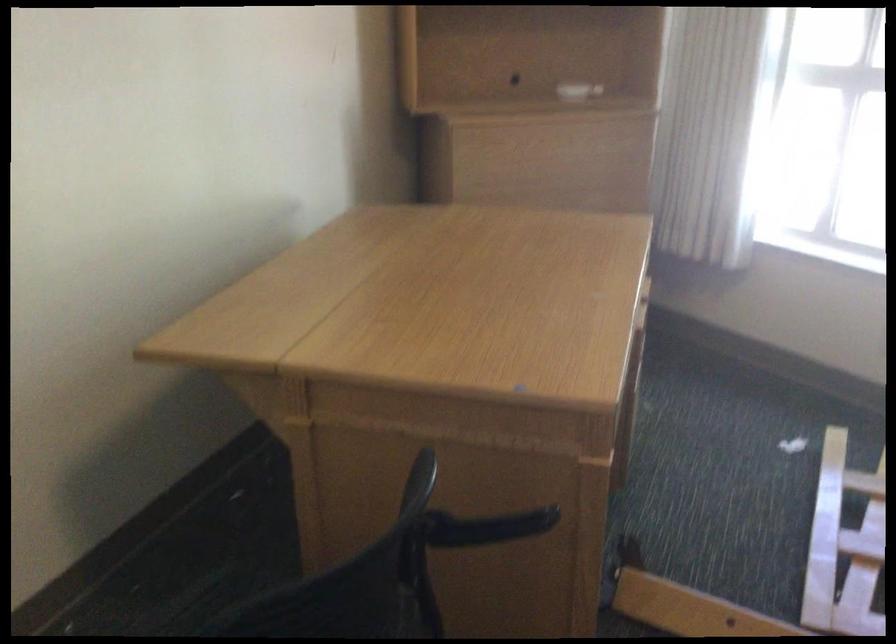
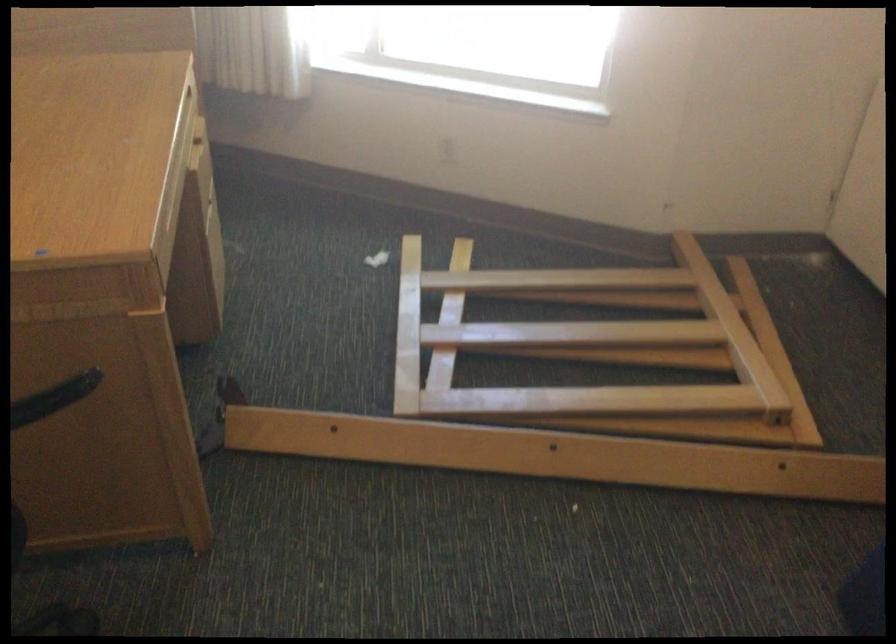
Question: Based on the continuous images, in which direction is the camera rotating? Reply with the corresponding letter.

Choices:
 (A) Left
 (B) Right
 (C) Up
 (D) Down

Answer: (B)